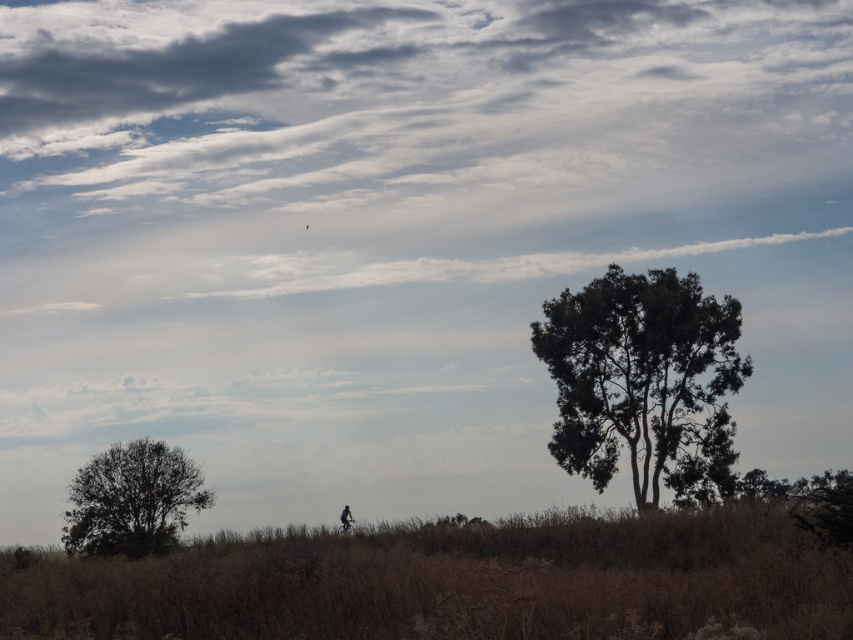
Question: Estimate the real-world distances between objects in this image. Which object is farther from the dark green leafy tree at lower left?

Choices:
 (A) dark silhouette figure at lower center
 (B) green leafy tree at right

Answer: (B)

Question: From the image, what is the correct spatial relationship of dark green leafy tree at lower left in relation to dark silhouette figure at lower center?

Choices:
 (A) left
 (B) right

Answer: (A)

Question: Does green leafy tree at right have a greater width compared to dark green leafy tree at lower left?

Choices:
 (A) yes
 (B) no

Answer: (A)

Question: Among these points, which one is nearest to the camera?

Choices:
 (A) (164, 468)
 (B) (648, 436)
 (C) (346, 513)

Answer: (A)

Question: Among these objects, which one is nearest to the camera?

Choices:
 (A) dark silhouette figure at lower center
 (B) dark green leafy tree at lower left
 (C) green leafy tree at right

Answer: (A)

Question: Considering the relative positions of dark green leafy tree at lower left and dark silhouette figure at lower center in the image provided, where is dark green leafy tree at lower left located with respect to dark silhouette figure at lower center?

Choices:
 (A) right
 (B) left

Answer: (B)